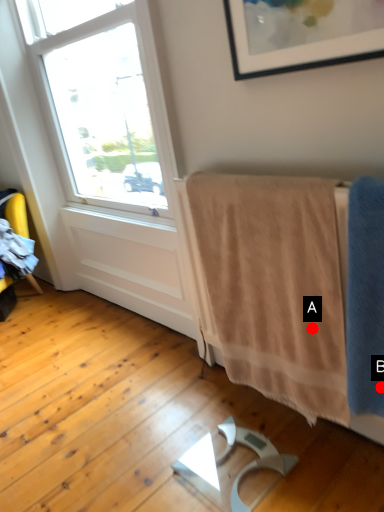
Question: Two points are circled on the image, labeled by A and B beside each circle. Which point is closer to the camera?

Choices:
 (A) A is closer
 (B) B is closer

Answer: (B)